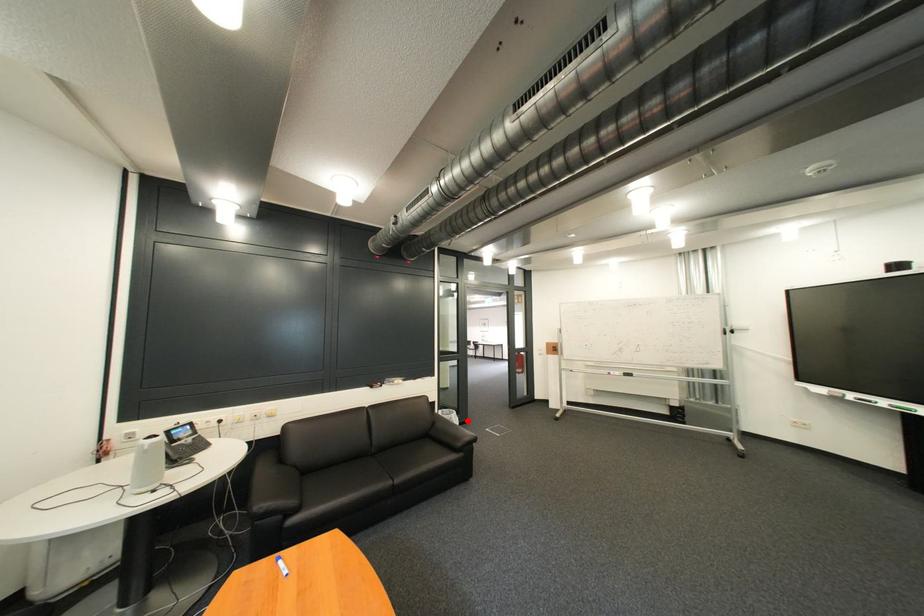
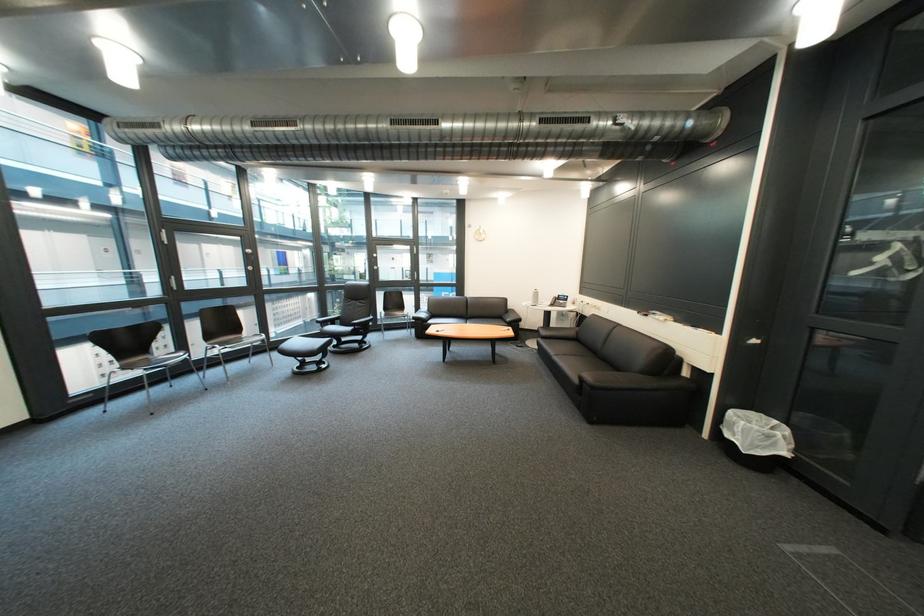
Question: I am providing you with two images of the same scene from different viewpoints. Given a red point in image1, look at the same physical point in image2. Is it:

Choices:
 (A) Closer to the viewpoint
 (B) Farther from the viewpoint

Answer: (A)